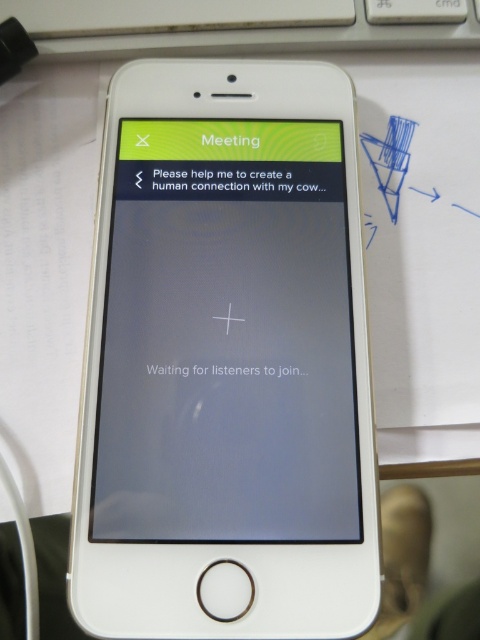
Who is positioned more to the right, matte glass screen at center or white plastic keyboard at upper center?

white plastic keyboard at upper center is more to the right.

Can you confirm if matte glass screen at center is positioned to the left of white plastic keyboard at upper center?

Indeed, matte glass screen at center is positioned on the left side of white plastic keyboard at upper center.

Identify the location of matte glass screen at center. (227, 337).